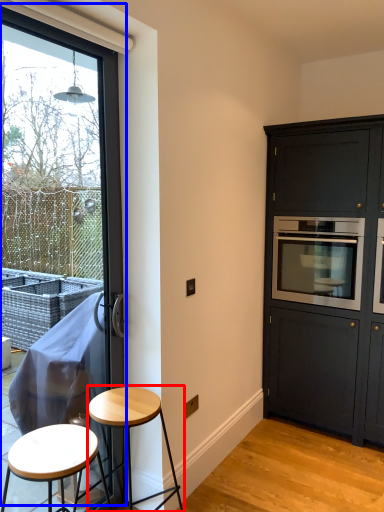
Question: Which point is further to the camera, stool (highlighted by a red box) or window (highlighted by a blue box)?

Choices:
 (A) stool
 (B) window

Answer: (A)